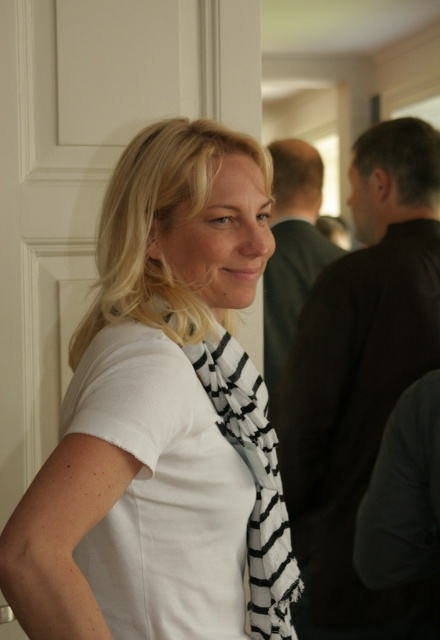
Question: Among these objects, which one is nearest to the camera?

Choices:
 (A) dark brown leather jacket at upper center
 (B) white matte scarf at center
 (C) black matte vest at right
 (D) black and white striped scarf at center

Answer: (B)

Question: Does black matte vest at right have a larger size compared to dark brown leather jacket at upper center?

Choices:
 (A) yes
 (B) no

Answer: (A)

Question: Which of the following is the farthest from the observer?

Choices:
 (A) (370, 252)
 (B) (246, 374)

Answer: (A)

Question: Is white matte scarf at center thinner than black and white striped scarf at center?

Choices:
 (A) no
 (B) yes

Answer: (A)

Question: Which point is closer to the camera?

Choices:
 (A) (334, 548)
 (B) (164, 237)
 (C) (332, 243)

Answer: (B)

Question: Is black matte vest at right positioned before dark brown leather jacket at upper center?

Choices:
 (A) yes
 (B) no

Answer: (A)